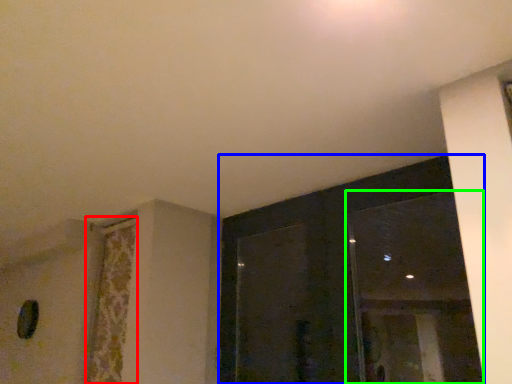
Question: Which is nearer to the curtain (highlighted by a red box)? window (highlighted by a blue box) or window (highlighted by a green box).

Choices:
 (A) window
 (B) window

Answer: (A)